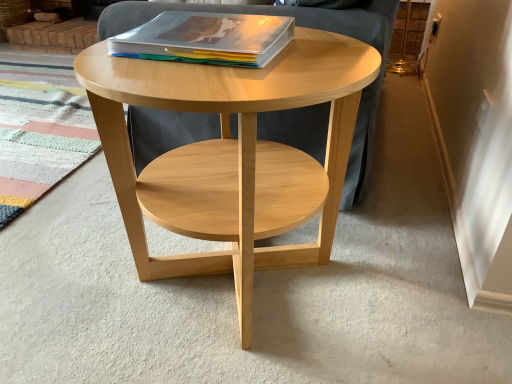
The height and width of the screenshot is (384, 512). I want to click on free location to the right of natural wood coffee table at center, so click(400, 267).